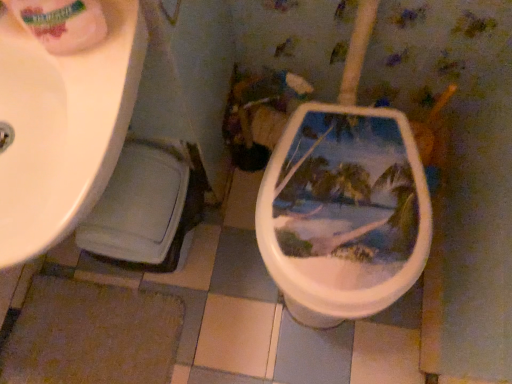
Question: Does white glossy toilet paper at upper left have a larger size compared to white glossy sink at upper left?

Choices:
 (A) yes
 (B) no

Answer: (B)

Question: Does white glossy toilet paper at upper left have a greater height compared to white glossy sink at upper left?

Choices:
 (A) yes
 (B) no

Answer: (B)

Question: Could you tell me if white glossy toilet paper at upper left is turned towards white glossy sink at upper left?

Choices:
 (A) no
 (B) yes

Answer: (A)

Question: Considering the relative positions of white glossy toilet paper at upper left and white glossy sink at upper left in the image provided, is white glossy toilet paper at upper left in front of white glossy sink at upper left?

Choices:
 (A) yes
 (B) no

Answer: (A)

Question: Considering the relative sizes of white glossy toilet paper at upper left and white glossy sink at upper left in the image provided, is white glossy toilet paper at upper left wider than white glossy sink at upper left?

Choices:
 (A) yes
 (B) no

Answer: (B)

Question: Is white glossy toilet paper at upper left at the right side of white glossy sink at upper left?

Choices:
 (A) no
 (B) yes

Answer: (B)

Question: Is the depth of white glossy sink at upper left less than that of white glossy toilet paper at upper left?

Choices:
 (A) yes
 (B) no

Answer: (B)

Question: Would you say white glossy toilet paper at upper left is part of white glossy sink at upper left's contents?

Choices:
 (A) yes
 (B) no

Answer: (B)

Question: From a real-world perspective, is white glossy sink at upper left over white glossy toilet paper at upper left?

Choices:
 (A) no
 (B) yes

Answer: (A)

Question: Would you say white glossy sink at upper left is a long distance from white glossy toilet paper at upper left?

Choices:
 (A) yes
 (B) no

Answer: (B)

Question: Is white glossy sink at upper left taller than white glossy toilet paper at upper left?

Choices:
 (A) no
 (B) yes

Answer: (B)

Question: Can you confirm if white glossy sink at upper left is shorter than white glossy toilet paper at upper left?

Choices:
 (A) no
 (B) yes

Answer: (A)

Question: Considering the positions of white glossy toilet paper at upper left and white glossy sink at upper left in the image, is white glossy toilet paper at upper left taller or shorter than white glossy sink at upper left?

Choices:
 (A) tall
 (B) short

Answer: (B)